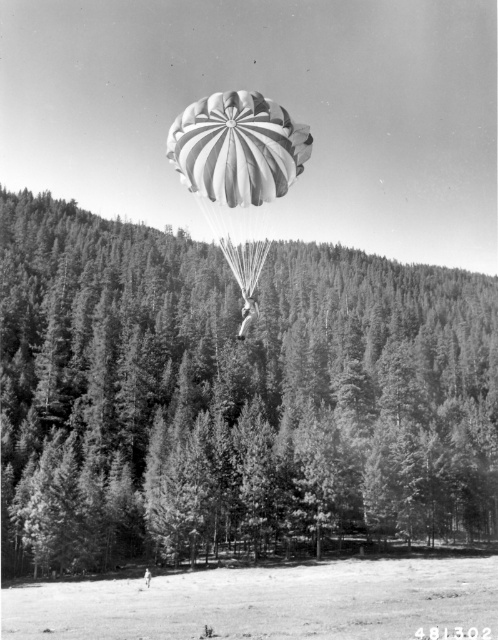
Question: Can you confirm if green leafy tree at center is positioned to the left of white cotton shirt at center?

Choices:
 (A) yes
 (B) no

Answer: (A)

Question: Does white striped parachute at center appear over white cotton shirt at center?

Choices:
 (A) no
 (B) yes

Answer: (B)

Question: Among these objects, which one is farthest from the camera?

Choices:
 (A) green leafy tree at center
 (B) white striped parachute at center

Answer: (A)

Question: In this image, where is white striped parachute at center located relative to white cotton shirt at center?

Choices:
 (A) above
 (B) below

Answer: (A)

Question: Which object appears closest to the camera in this image?

Choices:
 (A) white striped parachute at center
 (B) white cotton shirt at center

Answer: (A)

Question: Which point is closer to the camera?

Choices:
 (A) (373, 269)
 (B) (145, 582)
 (C) (251, 109)

Answer: (C)